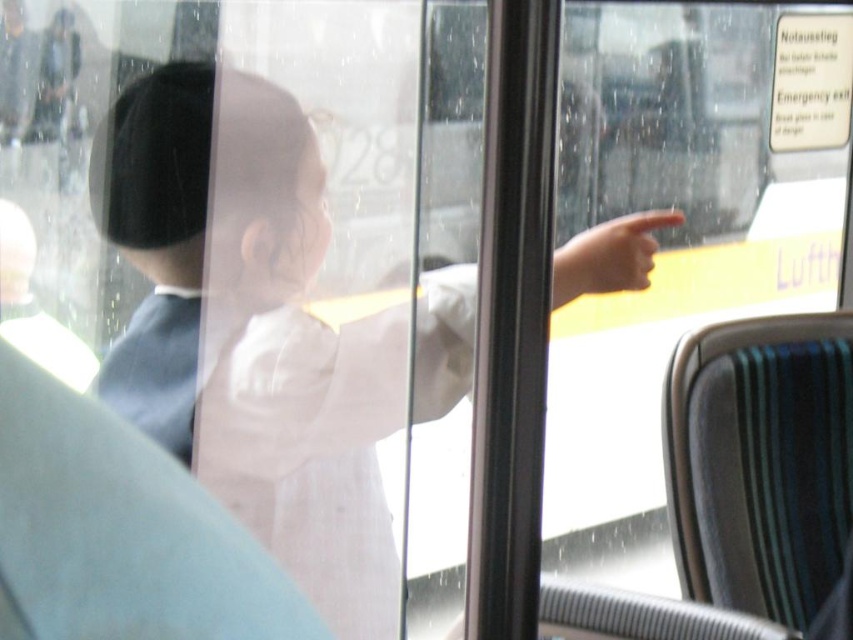
You are a passenger on a bus and you see a white cloth at center and a smooth skin hand at center. Which object is located lower in the scene?

The white cloth at center is located below the smooth skin hand at center, so the white cloth at center is lower in the scene.